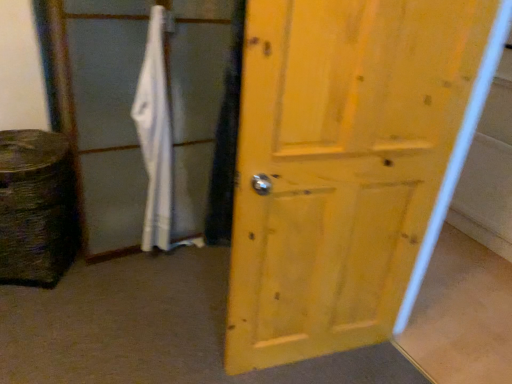
Question: From a real-world perspective, is yellow wood door at center positioned over white fabric bath towel at center-left based on gravity?

Choices:
 (A) yes
 (B) no

Answer: (A)

Question: Is yellow wood door at center wider than white fabric bath towel at center-left?

Choices:
 (A) no
 (B) yes

Answer: (A)

Question: Does yellow wood door at center contain white fabric bath towel at center-left?

Choices:
 (A) yes
 (B) no

Answer: (B)

Question: Are yellow wood door at center and white fabric bath towel at center-left far apart?

Choices:
 (A) no
 (B) yes

Answer: (A)

Question: From a real-world perspective, does yellow wood door at center sit lower than white fabric bath towel at center-left?

Choices:
 (A) no
 (B) yes

Answer: (A)

Question: Is the position of yellow wood door at center more distant than that of white fabric bath towel at center-left?

Choices:
 (A) no
 (B) yes

Answer: (A)

Question: Is white fabric bath towel at center-left bigger than yellow wood door at center?

Choices:
 (A) yes
 (B) no

Answer: (B)

Question: Considering the relative sizes of white fabric bath towel at center-left and yellow wood door at center in the image provided, is white fabric bath towel at center-left smaller than yellow wood door at center?

Choices:
 (A) yes
 (B) no

Answer: (A)

Question: Is white fabric bath towel at center-left thinner than yellow wood door at center?

Choices:
 (A) yes
 (B) no

Answer: (B)

Question: Is white fabric bath towel at center-left shorter than yellow wood door at center?

Choices:
 (A) no
 (B) yes

Answer: (B)

Question: Is white fabric bath towel at center-left further to camera compared to yellow wood door at center?

Choices:
 (A) yes
 (B) no

Answer: (A)

Question: Does white fabric bath towel at center-left come in front of yellow wood door at center?

Choices:
 (A) yes
 (B) no

Answer: (B)

Question: Is matte white screen door at center positioned in front of white fabric bath towel at center-left?

Choices:
 (A) yes
 (B) no

Answer: (A)